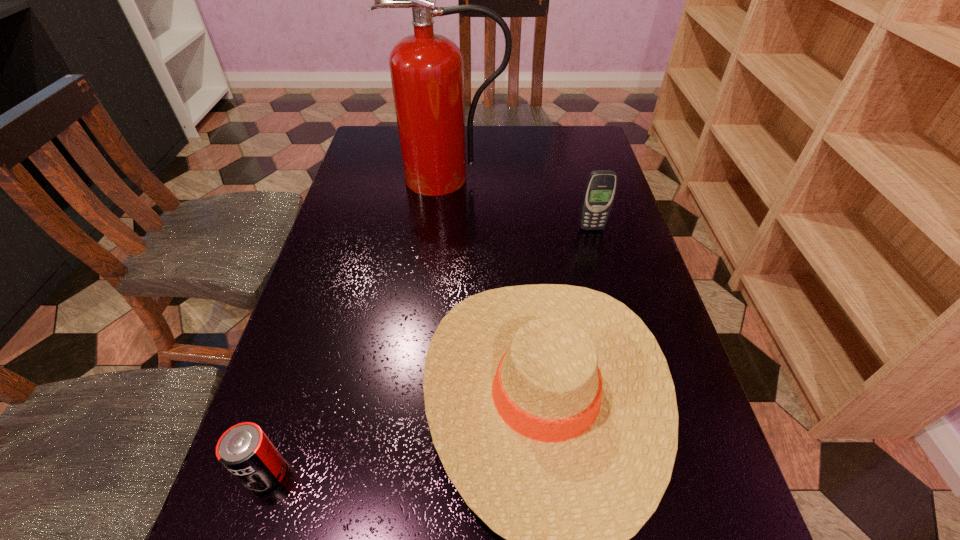
Identify the location of can at the left edge. The width and height of the screenshot is (960, 540). (244, 449).

Identify the location of object present at the right edge. (600, 189).

You are a GUI agent. You are given a task and a screenshot of the screen. Output one action in this format:
    pyautogui.click(x=<x>, y=<y>)
    Task: Click on the object that is at the far left corner
    
    Given the screenshot: What is the action you would take?
    pyautogui.click(x=427, y=73)

Identify the location of blank area at the far edge. (492, 126).

This screenshot has height=540, width=960. In order to click on vacant space at the left edge of the desktop in this screenshot , I will do `click(362, 361)`.

Find the location of a particular element. The width and height of the screenshot is (960, 540). free location at the right edge of the desktop is located at coordinates (655, 302).

This screenshot has height=540, width=960. Identify the location of vacant space at the far right corner. (555, 153).

Where is `vacant space that's between the fire extinguisher and the third shortest object`? vacant space that's between the fire extinguisher and the third shortest object is located at coordinates (520, 203).

You are a GUI agent. You are given a task and a screenshot of the screen. Output one action in this format:
    pyautogui.click(x=<x>, y=<y>)
    Task: Click on the empty space that is in between the cellular telephone and the fire extinguisher
    
    Given the screenshot: What is the action you would take?
    pyautogui.click(x=520, y=203)

Where is `free space between the third shortest object and the tallest object`? free space between the third shortest object and the tallest object is located at coordinates (520, 203).